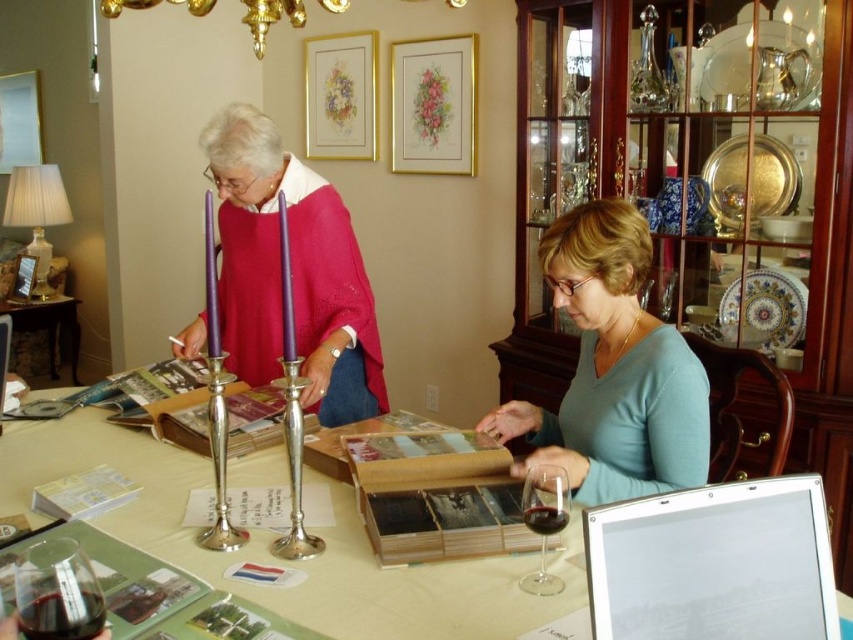
You are organizing a small event and need to place a decorative item on the table. The white paper at center and the white glossy tablet at lower right are both candidates. Which item should you choose if you want something taller for better visibility?

The white paper at center is taller than the white glossy tablet at lower right, so it would be better for better visibility.

You are a guest at this table and want to place your phone between the blue matte shirt at center and the translucent glass wine glass at lower left. Is there enough space between them to fit your phone?

The blue matte shirt at center is positioned on the right side of the translucent glass wine glass at lower left, so there is space between them to place your phone.

You are organizing a small event and need to place a 10cm tall decoration between the blue matte shirt at center and the white glossy tablet at lower right. Considering their heights, which object should the decoration be placed closer to?

The blue matte shirt at center is taller than the white glossy tablet at lower right. Therefore, the decoration should be placed closer to the white glossy tablet at lower right to maintain balance, as it is shorter.